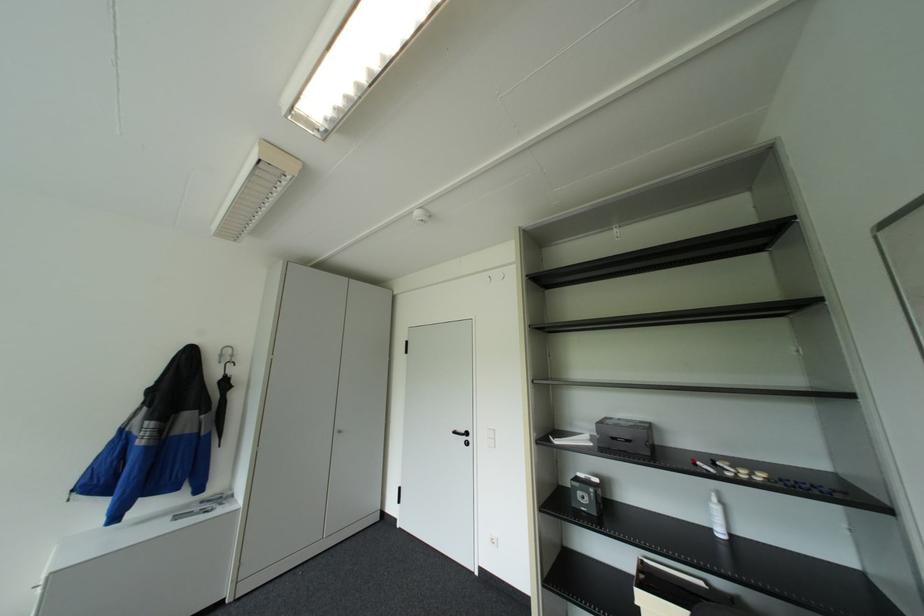
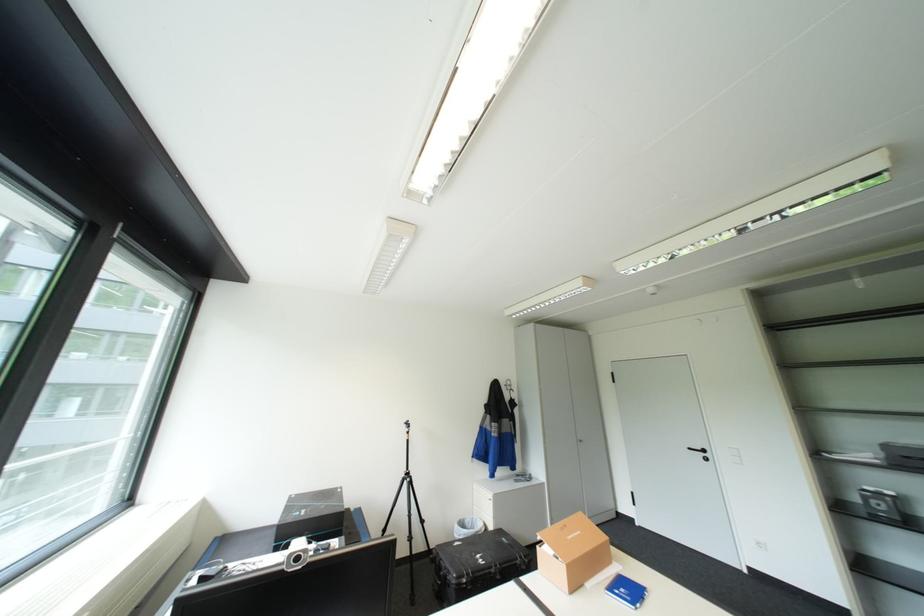
What movement of the cameraman would produce the second image?

The cameraman moved toward left, backward.